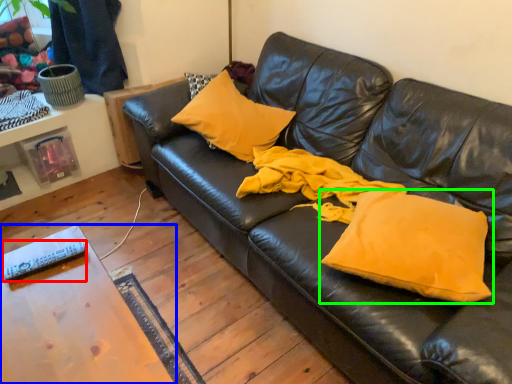
Question: Which is nearer to the remote (highlighted by a red box)? table (highlighted by a blue box) or pillow (highlighted by a green box).

Choices:
 (A) table
 (B) pillow

Answer: (A)